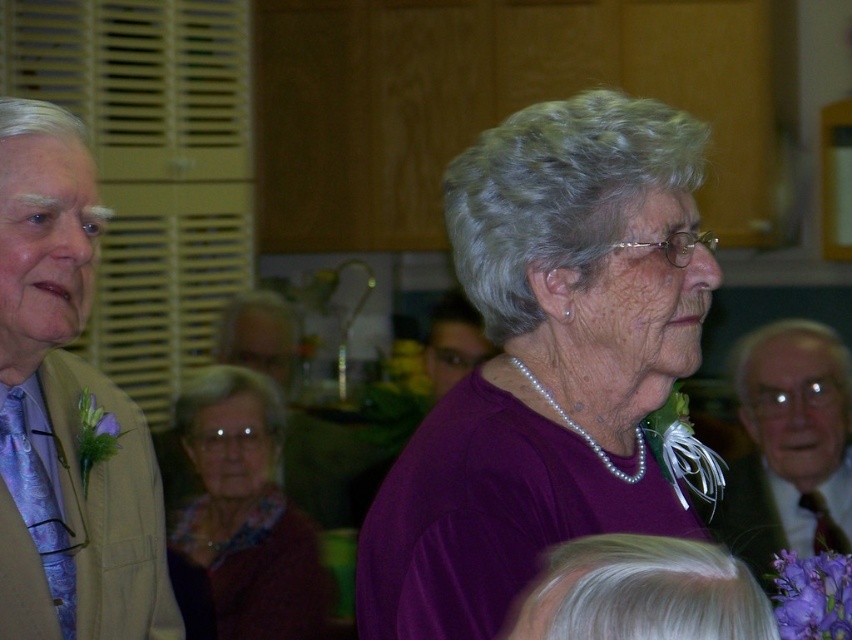
You are organizing a clothing display and want to arrange the purple matte shirt at center and the matte purple sweater at center side by side. Which one should you place on the right to ensure they fit within a 1.2 meter wide display area?

The purple matte shirt at center has a smaller width than the matte purple sweater at center, so placing the wider matte purple sweater at center on the right would allow both items to fit within the 1.2 meter display area as long as their combined widths do not exceed it.

You are an event photographer trying to capture a candid shot of the two main figures. The purple matte shirt at center and the matte brown suit at right are positioned in a way that might block each other. Based on their positions, which one is higher up in the frame?

The purple matte shirt at center is above the matte brown suit at right, so it is higher up in the frame.

You are an event planner trying to place a name tag for the purple matte shirt at center. What are the coordinates where you should place it?

The coordinates for placing the name tag for the purple matte shirt at center are at point (547, 362).